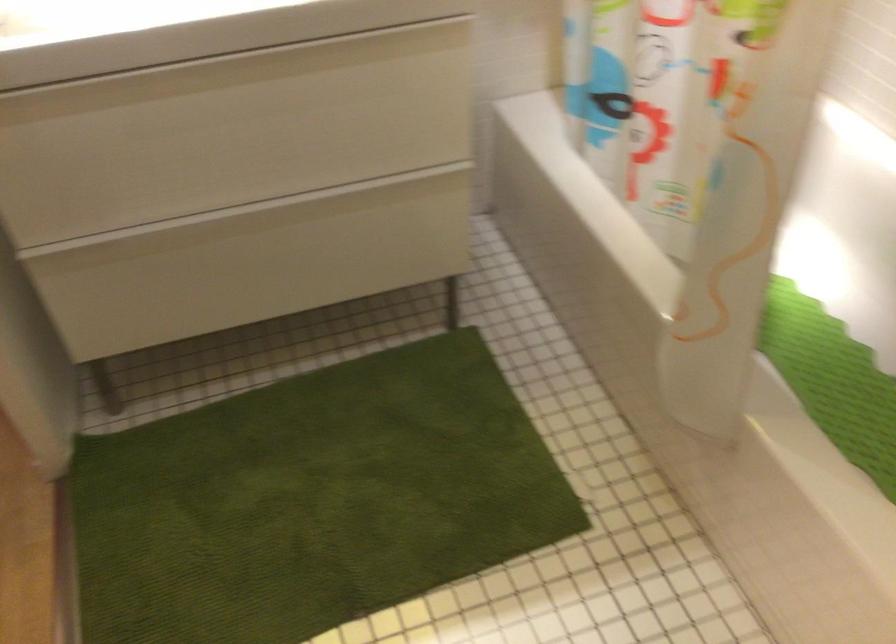
This screenshot has height=644, width=896. Describe the element at coordinates (228, 70) in the screenshot. I see `the top drawer handle` at that location.